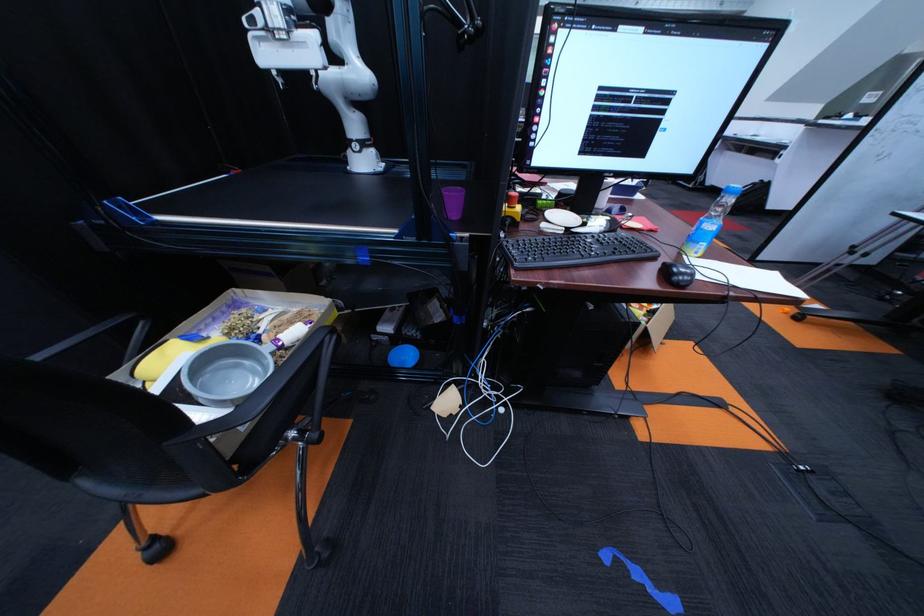
Find the location of `plastic water bottle`. plastic water bottle is located at coordinates (710, 222).